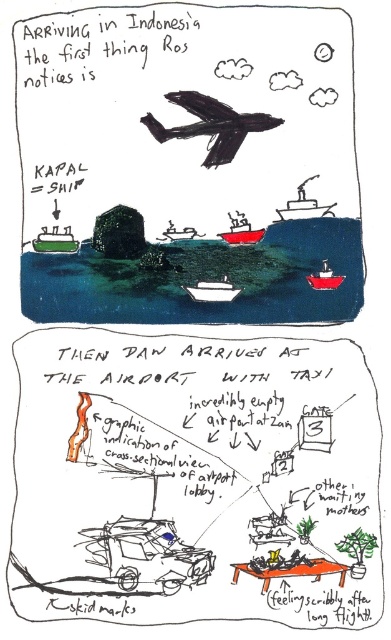
You are a pilot flying a black matte airplane at upper center and need to land on the metallic red boat at center anchored below. Can you safely descend without hitting the boat?

The black matte airplane at upper center has a greater height compared to the metallic red boat at center, so you can safely descend without hitting the boat as there is enough vertical space between them.

You are planning to dock your small yacht at the anchorage area shown in the top panel. The green matte boat at center and the metallic red boat at center are already there. Since your yacht is 10 meters long, which boat should you position closer to if you want to maximize space for your yacht?

The green matte boat at center has a smaller size compared to metallic red boat at center. Therefore, positioning your yacht closer to the green matte boat at center would allow more space between it and the larger metallic red boat at center, maximizing available space.